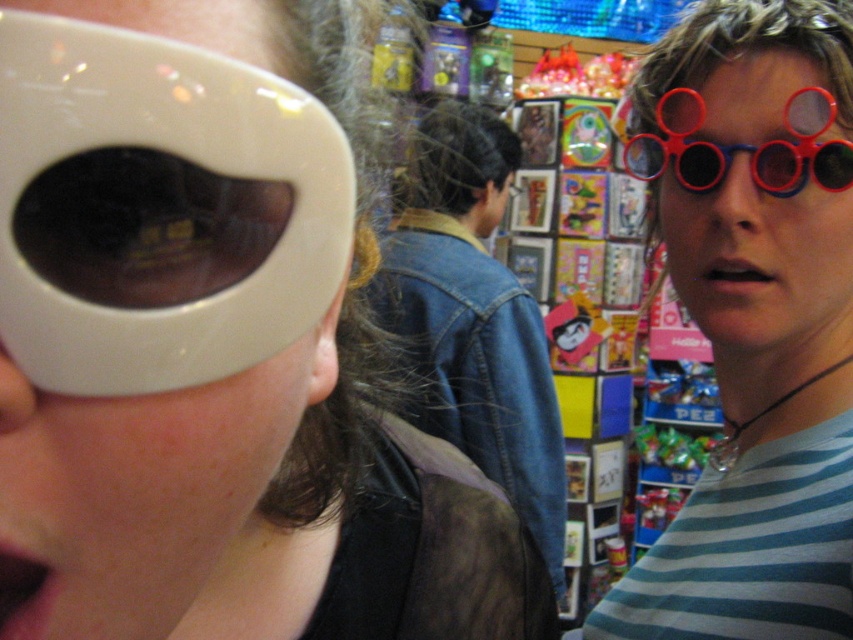
You are standing at the origin point in the store. Which of the two points, point [708,324] or point [502,148], is closer to you?

Point [502,148] is closer to you because it is behind point [708,324].

You are a customer in the store and want to buy the matte plastic glasses at center. The store has a discount for items smaller than the denim jacket at center. Will you get the discount?

The matte plastic glasses at center has a smaller size compared to denim jacket at center, so yes, you will get the discount.

You are a customer in the store looking for sunglasses. You see the matte plastic glasses at right and the matte black sunglasses at center. Which one is located to the right of the other?

The matte plastic glasses at right is positioned on the right side of matte black sunglasses at center.